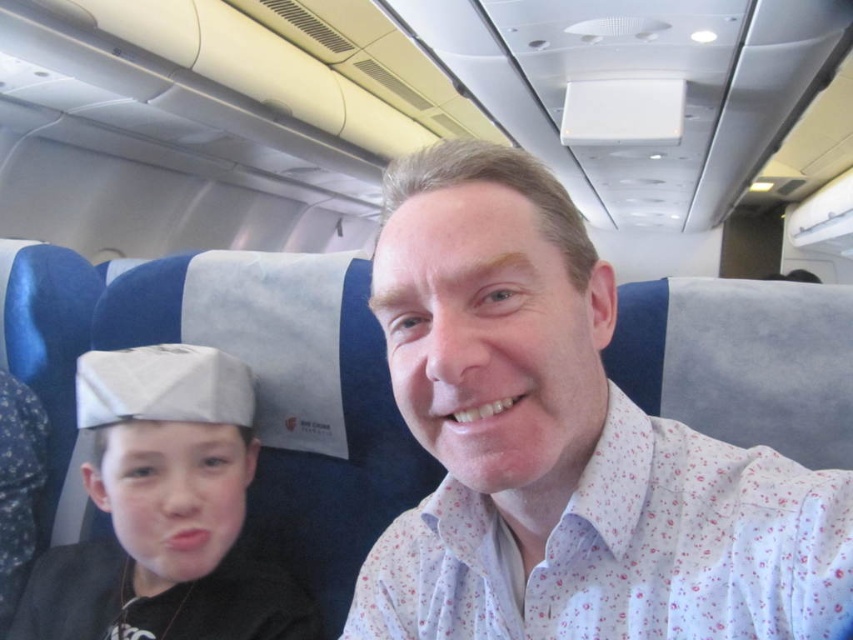
What do you see at coordinates (564, 445) in the screenshot? I see `white floral shirt at center` at bounding box center [564, 445].

Does white floral shirt at center appear on the left side of gray fabric cap at left?

No, white floral shirt at center is not to the left of gray fabric cap at left.

Which is in front, point (639, 465) or point (141, 596)?

Point (639, 465)

The width and height of the screenshot is (853, 640). In order to click on white floral shirt at center in this screenshot , I will do `click(564, 445)`.